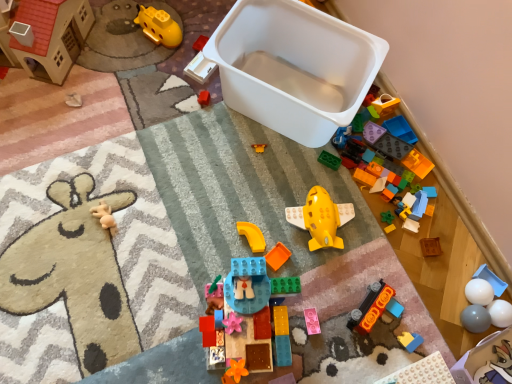
Where is `free space to the left of beige rubber bear at left, which ranks as the 15th toy in right-to-left order`? This screenshot has height=384, width=512. free space to the left of beige rubber bear at left, which ranks as the 15th toy in right-to-left order is located at coordinates coord(48,205).